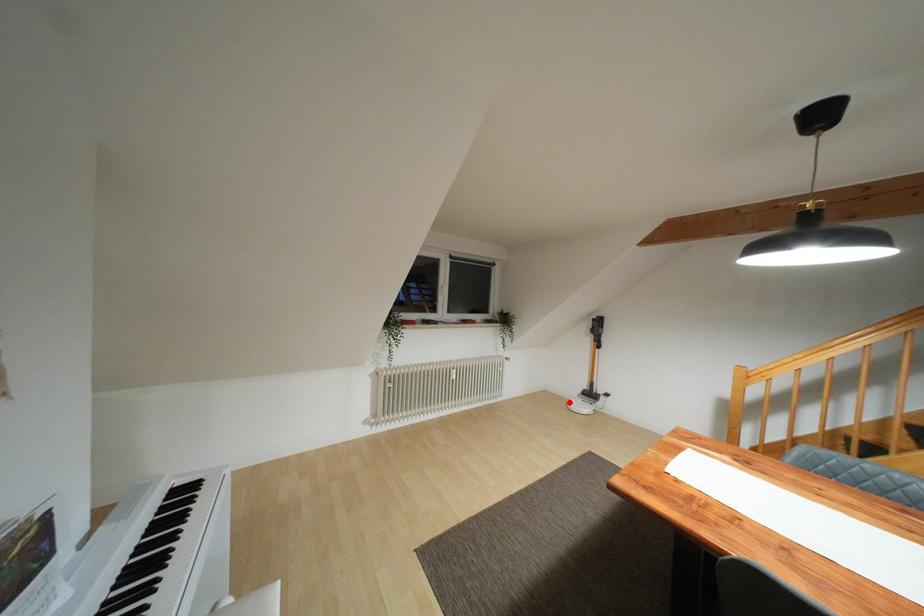
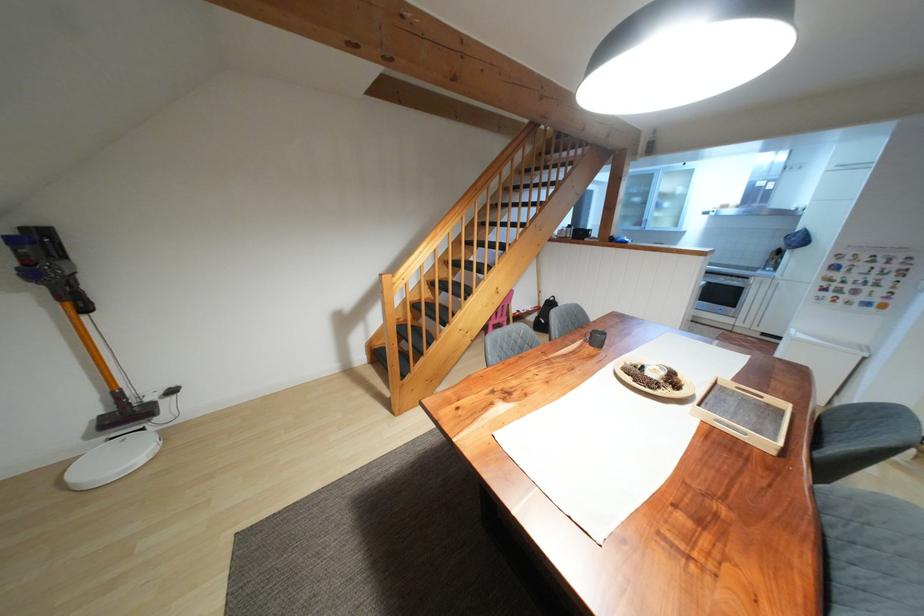
The point at the highlighted location is marked in the first image. Where is the corresponding point in the second image?

(74, 474)